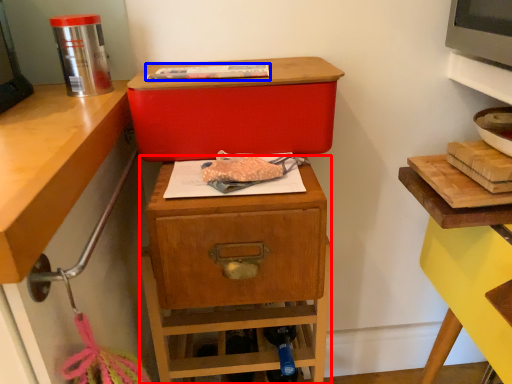
Question: Which of the following is the farthest to the observer, nightstand (highlighted by a red box) or food (highlighted by a blue box)?

Choices:
 (A) nightstand
 (B) food

Answer: (A)